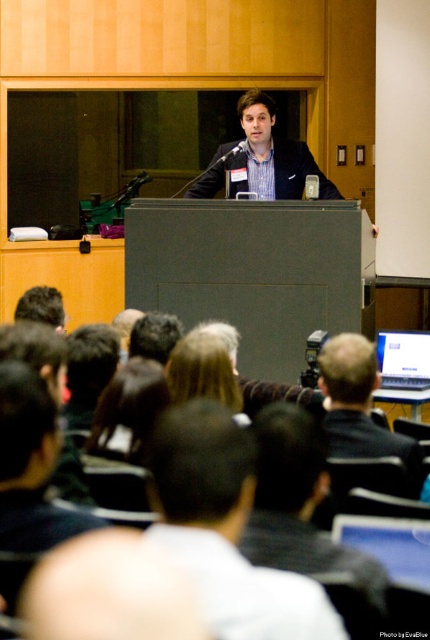
You are sitting in the audience and want to wave to both dark brown hair at lower left and dark brown hair at center. Which one should you wave to first if you want to start with the person closer to your left side?

You should wave to dark brown hair at center first because it is positioned to the left of dark brown hair at lower left, making it closer to your left side.